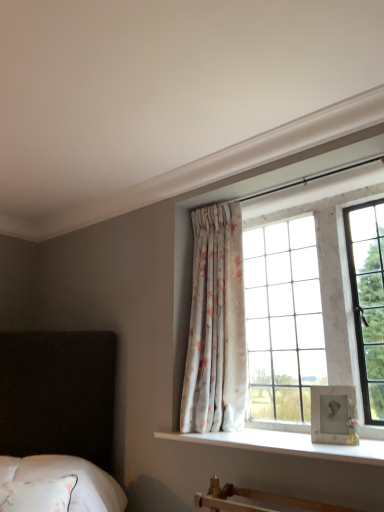
Question: Looking at the image, does white soft bedding at lower left seem bigger or smaller compared to floral fabric curtain at center?

Choices:
 (A) small
 (B) big

Answer: (A)

Question: Looking at their shapes, would you say white soft bedding at lower left is wider or thinner than floral fabric curtain at center?

Choices:
 (A) wide
 (B) thin

Answer: (A)

Question: Considering the real-world distances, which object is farthest from the floral fabric curtain at center?

Choices:
 (A) white textured glass at upper right
 (B) white soft bedding at lower left
 (C) white smooth window sill at center

Answer: (B)

Question: Based on their relative distances, which object is farther from the white soft bedding at lower left?

Choices:
 (A) floral fabric curtain at center
 (B) white smooth window sill at center
 (C) white textured glass at upper right

Answer: (C)